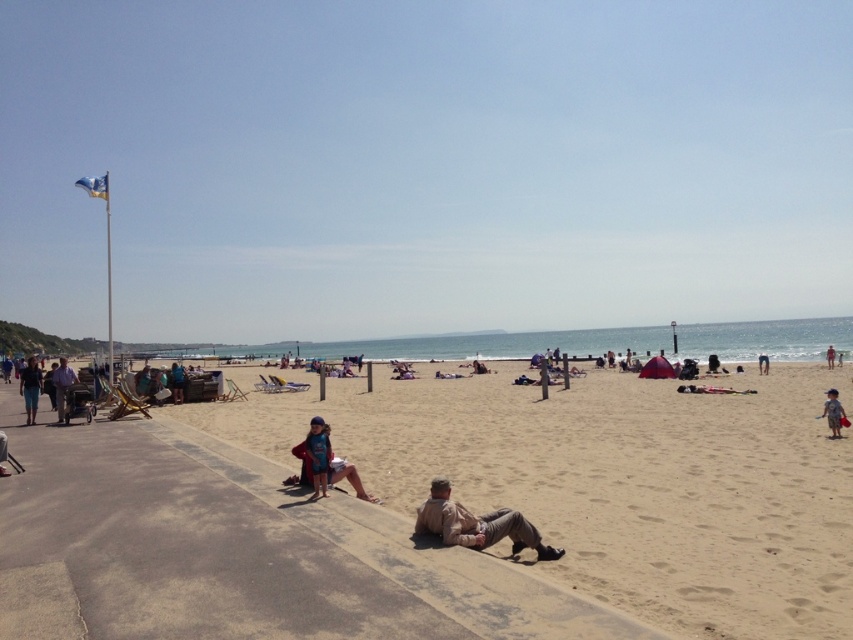
Does light brown sand at lower center appear over camouflage fabric jacket at lower center?

No.

Can you confirm if light brown sand at lower center is wider than camouflage fabric jacket at lower center?

Yes, light brown sand at lower center is wider than camouflage fabric jacket at lower center.

Is point (563, 544) farther from camera compared to point (468, 528)?

Yes, point (563, 544) is farther from viewer.

This screenshot has width=853, height=640. I want to click on light brown sand at lower center, so click(614, 481).

Is blue denim shorts at lower center further to the viewer compared to blue fabric bag at center?

No, blue denim shorts at lower center is in front of blue fabric bag at center.

Which is above, blue denim shorts at lower center or blue fabric bag at center?

blue denim shorts at lower center is higher up.

Find the location of `blue denim shorts at lower center`. blue denim shorts at lower center is located at coordinates (318, 456).

The width and height of the screenshot is (853, 640). I want to click on blue denim shorts at lower center, so (318, 456).

Identify the location of light blue denim shorts at lower right. The image size is (853, 640). (833, 412).

Between light blue denim shorts at lower right and blue fabric bag at center, which one is positioned lower?

blue fabric bag at center is below.

The height and width of the screenshot is (640, 853). What do you see at coordinates (833, 412) in the screenshot?
I see `light blue denim shorts at lower right` at bounding box center [833, 412].

At what (x,y) coordinates should I click in order to perform the action: click on light blue denim shorts at lower right. Please return your answer as a coordinate pair (x, y). Looking at the image, I should click on (833, 412).